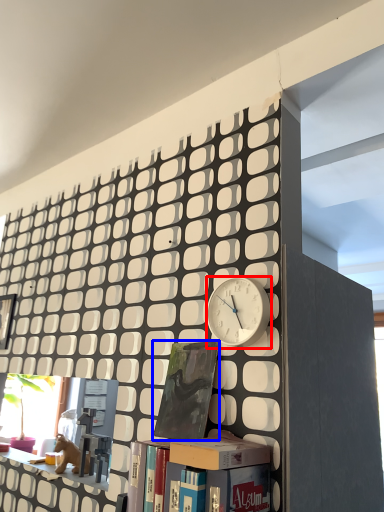
Question: Which of the following is the farthest to the observer, clock (highlighted by a red box) or book (highlighted by a blue box)?

Choices:
 (A) clock
 (B) book

Answer: (B)